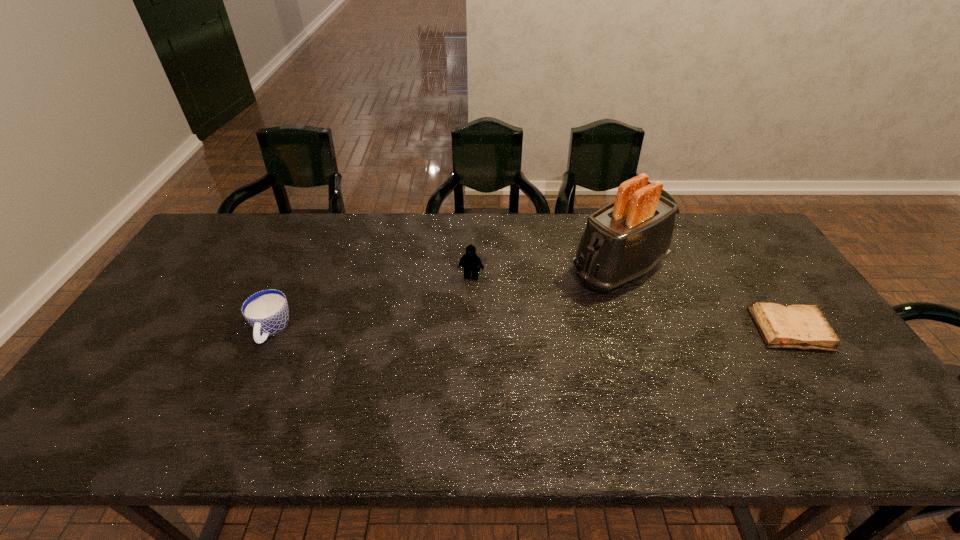
Identify the location of vacant area that lies between the cup and the Lego. This screenshot has width=960, height=540. (372, 304).

The width and height of the screenshot is (960, 540). What are the coordinates of `free space between the second shortest object and the second tallest object` in the screenshot? It's located at (372, 304).

Where is `the second closest object to the Lego`? This screenshot has height=540, width=960. the second closest object to the Lego is located at coordinates (267, 311).

The width and height of the screenshot is (960, 540). I want to click on the second closest object to the tallest object, so click(470, 260).

The width and height of the screenshot is (960, 540). I want to click on free location that satisfies the following two spatial constraints: 1. on the front side of the third object from right to left; 2. on the right side of the shortest object, so click(470, 329).

This screenshot has height=540, width=960. Identify the location of vacant space that satisfies the following two spatial constraints: 1. on the back side of the tallest object; 2. on the left side of the third shortest object. (471, 269).